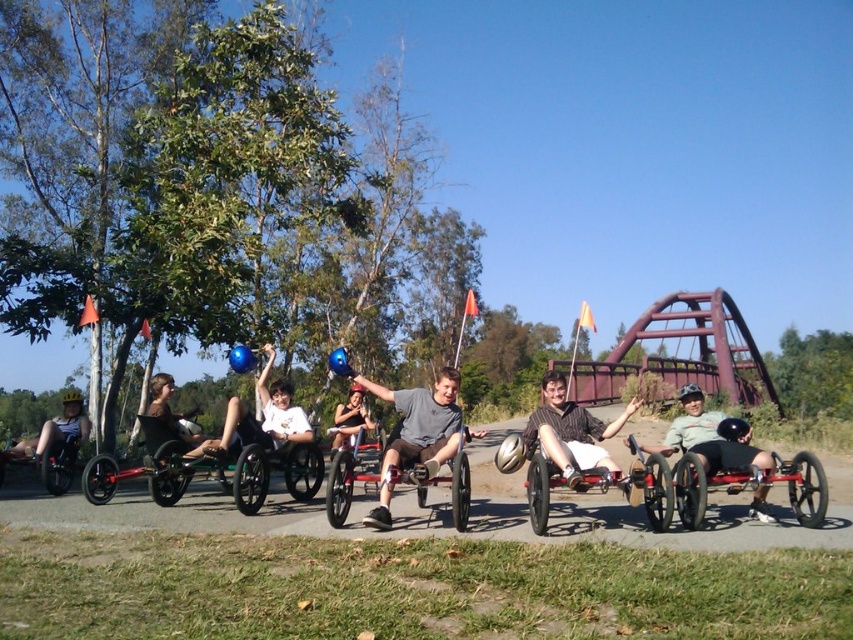
Is point (347, 464) closer to camera compared to point (550, 468)?

No, (347, 464) is behind (550, 468).

Is metallic red wheelchair at center to the left of matte black tricycle at center from the viewer's perspective?

Indeed, metallic red wheelchair at center is positioned on the left side of matte black tricycle at center.

Does point (442, 481) come in front of point (668, 468)?

That is False.

Image resolution: width=853 pixels, height=640 pixels. What are the coordinates of `metallic red wheelchair at center` in the screenshot? It's located at (354, 470).

What are the coordinates of `metallic red tricycle at center` in the screenshot? It's located at (751, 484).

Can you confirm if white matte balloon at center is bigger than matte black wheelchair at center?

Correct, white matte balloon at center is larger in size than matte black wheelchair at center.

Identify the location of white matte balloon at center. (262, 419).